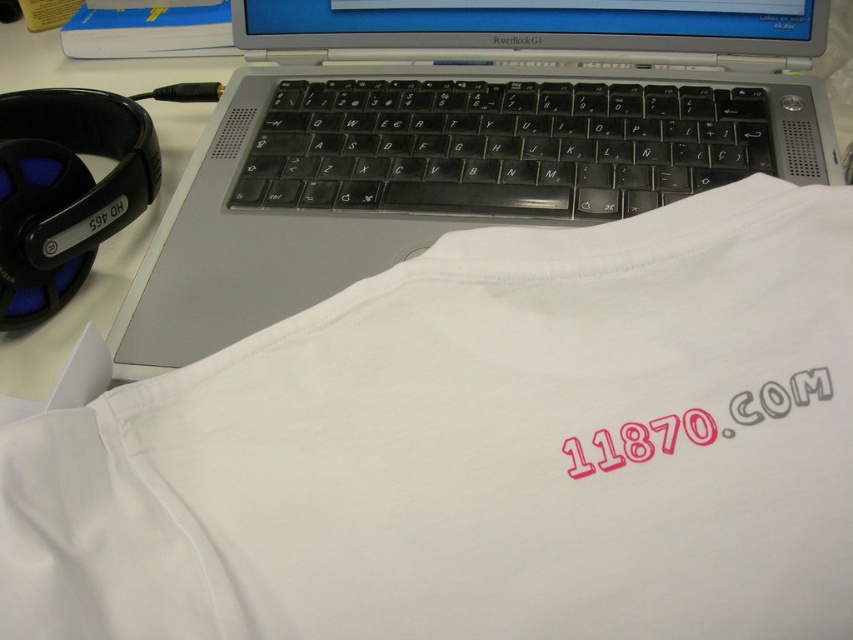
Question: Is white cotton t-shirt at center bigger than white matte laptop at center?

Choices:
 (A) yes
 (B) no

Answer: (B)

Question: Which of the following is the farthest from the observer?

Choices:
 (A) (550, 401)
 (B) (355, 228)

Answer: (B)

Question: Is white cotton t-shirt at center closer to the viewer compared to white matte laptop at center?

Choices:
 (A) no
 (B) yes

Answer: (B)

Question: Considering the relative positions of white cotton t-shirt at center and white matte laptop at center in the image provided, where is white cotton t-shirt at center located with respect to white matte laptop at center?

Choices:
 (A) above
 (B) below

Answer: (B)

Question: Which of the following is the closest to the observer?

Choices:
 (A) white cotton t-shirt at center
 (B) white matte laptop at center

Answer: (A)